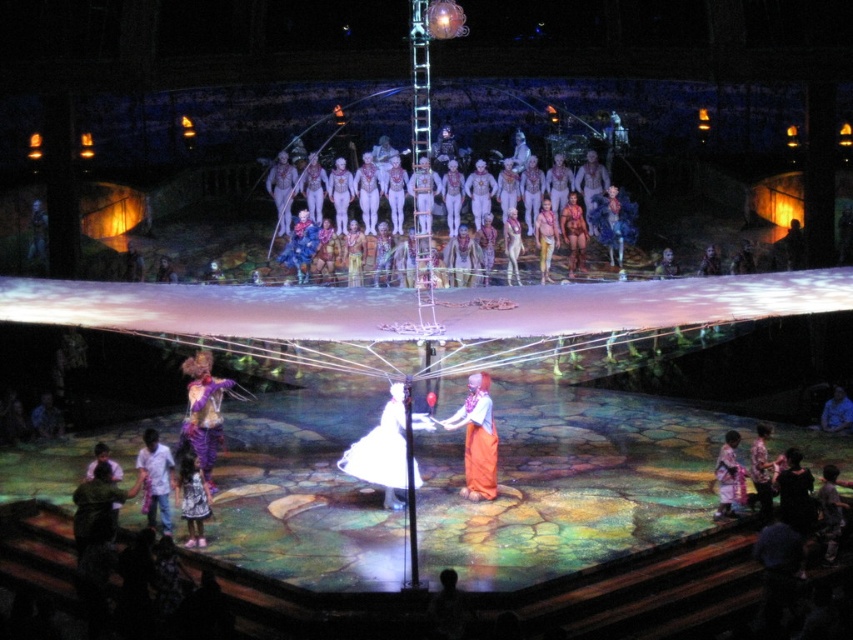
You are a stagehand responsible for setting up the next act. You need to place a large prop that requires 2 meters of space between the white matte bodies at center and the patterned fabric dress at lower right. Based on their widths, can the prop be placed between them without moving either object?

The white matte bodies at center are wider than the patterned fabric dress at lower right. Since the prop requires 2 meters of space between them, and the description only provides information about their widths, not the distance between them, it is unclear if there is sufficient space. The answer would depend on the actual distance between the two objects, which isn

You are a stagehand preparing to adjust the lighting for the performance. You need to ensure that both the white matte bodies at center and the patterned fabric dress at lower right are equally illuminated. Considering their sizes, which object requires more light to achieve the same brightness?

The white matte bodies at center has a larger size compared to the patterned fabric dress at lower right, so it requires more light to achieve the same brightness.

You are a stagehand preparing to adjust the lighting for the performance. You need to ensure that the orange fabric at center and the printed cotton dress at lower left are both illuminated. Considering their positions, which object should you adjust the spotlight towards first to ensure it reaches the closer one first?

The orange fabric at center is closer to the viewer than the printed cotton dress at lower left, so you should adjust the spotlight towards the orange fabric at center first to ensure it reaches the closer object first.